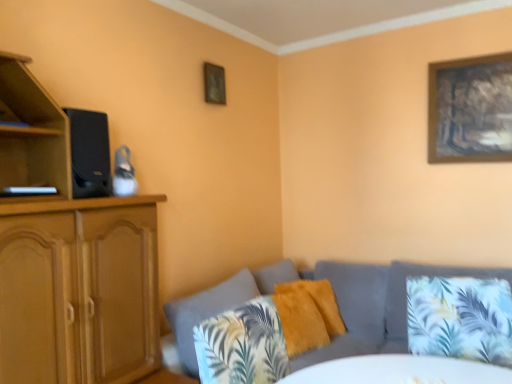
This screenshot has height=384, width=512. What do you see at coordinates (460, 318) in the screenshot? I see `printed fabric pillow at lower right, which is counted as the 3th pillow, starting from the back` at bounding box center [460, 318].

What do you see at coordinates (214, 84) in the screenshot? I see `wooden picture frame at upper center, placed as the second picture frame when sorted from right to left` at bounding box center [214, 84].

This screenshot has width=512, height=384. What do you see at coordinates (318, 301) in the screenshot?
I see `fuzzy yellow pillow at center, which ranks as the 3th pillow in front-to-back order` at bounding box center [318, 301].

Find the location of a particular element. The image size is (512, 384). fluffy orange pillow at center, marked as the second pillow in a front-to-back arrangement is located at coordinates (300, 322).

This screenshot has height=384, width=512. What are the coordinates of `black matte speaker at left` in the screenshot? It's located at (89, 153).

At what (x,y) coordinates should I click in order to perform the action: click on printed fabric pillow at lower right, which is counted as the 3th pillow, starting from the back. Please return your answer as a coordinate pair (x, y). The height and width of the screenshot is (384, 512). Looking at the image, I should click on (460, 318).

Could you tell me if textured gray couch at lower right is turned towards fluffy orange pillow at center, marked as the second pillow in a front-to-back arrangement?

Yes, textured gray couch at lower right faces towards fluffy orange pillow at center, marked as the second pillow in a front-to-back arrangement.

Is textured gray couch at lower right taller or shorter than fluffy orange pillow at center, positioned as the second pillow in back-to-front order?

Clearly, textured gray couch at lower right is taller compared to fluffy orange pillow at center, positioned as the second pillow in back-to-front order.

From the image's perspective, does textured gray couch at lower right appear higher than fluffy orange pillow at center, positioned as the second pillow in back-to-front order?

No.

Is textured gray couch at lower right not close to fluffy orange pillow at center, marked as the second pillow in a front-to-back arrangement?

That's not correct — textured gray couch at lower right is a little close to fluffy orange pillow at center, marked as the second pillow in a front-to-back arrangement.

Is wooden framed artwork at upper right, which is the 1th picture frame in right-to-left order, smaller than black matte speaker at left?

Incorrect, wooden framed artwork at upper right, which is the 1th picture frame in right-to-left order, is not smaller in size than black matte speaker at left.

What are the coordinates of `speaker below the wooden framed artwork at upper right, which is the 1th picture frame in right-to-left order (from a real-world perspective)` in the screenshot? It's located at (89, 153).

Which object is further away from the camera, wooden framed artwork at upper right, which is the 1th picture frame in right-to-left order, or black matte speaker at left?

Positioned behind is wooden framed artwork at upper right, which is the 1th picture frame in right-to-left order.

Is wooden framed artwork at upper right, arranged as the second picture frame when viewed from the left, looking in the opposite direction of black matte speaker at left?

No, wooden framed artwork at upper right, arranged as the second picture frame when viewed from the left, is not facing the opposite direction of black matte speaker at left.

From the image's perspective, is wooden framed artwork at upper right, arranged as the second picture frame when viewed from the left, located above or below fluffy orange pillow at center, marked as the second pillow in a front-to-back arrangement?

wooden framed artwork at upper right, arranged as the second picture frame when viewed from the left, is situated higher than fluffy orange pillow at center, marked as the second pillow in a front-to-back arrangement, in the image.

Does wooden framed artwork at upper right, arranged as the second picture frame when viewed from the left, lie behind fluffy orange pillow at center, positioned as the second pillow in back-to-front order?

Yes, it is.

Do you think wooden framed artwork at upper right, arranged as the second picture frame when viewed from the left, is within fluffy orange pillow at center, positioned as the second pillow in back-to-front order, or outside of it?

wooden framed artwork at upper right, arranged as the second picture frame when viewed from the left, is outside fluffy orange pillow at center, positioned as the second pillow in back-to-front order.

From a real-world perspective, is wooden framed artwork at upper right, arranged as the second picture frame when viewed from the left, over fluffy orange pillow at center, marked as the second pillow in a front-to-back arrangement?

Yes.

Considering the sizes of textured gray couch at lower right and fuzzy yellow pillow at center, which is the first pillow in back-to-front order, in the image, is textured gray couch at lower right taller or shorter than fuzzy yellow pillow at center, which is the first pillow in back-to-front order,?

→ In the image, textured gray couch at lower right appears to be taller than fuzzy yellow pillow at center, which is the first pillow in back-to-front order.

Does textured gray couch at lower right touch fuzzy yellow pillow at center, which ranks as the 3th pillow in front-to-back order?

No, textured gray couch at lower right is not with fuzzy yellow pillow at center, which ranks as the 3th pillow in front-to-back order.

Measure the distance between textured gray couch at lower right and fuzzy yellow pillow at center, which ranks as the 3th pillow in front-to-back order.

A distance of 10.72 inches exists between textured gray couch at lower right and fuzzy yellow pillow at center, which ranks as the 3th pillow in front-to-back order.

Looking at this image, from a real-world perspective, is textured gray couch at lower right physically located above or below fuzzy yellow pillow at center, which ranks as the 3th pillow in front-to-back order?

textured gray couch at lower right is below fuzzy yellow pillow at center, which ranks as the 3th pillow in front-to-back order.

From the image's perspective, which one is positioned lower, fluffy orange pillow at center, marked as the second pillow in a front-to-back arrangement, or wooden picture frame at upper center, the first picture frame when ordered from left to right?

From the image's view, fluffy orange pillow at center, marked as the second pillow in a front-to-back arrangement, is below.

Is wooden picture frame at upper center, placed as the second picture frame when sorted from right to left, at the back of fluffy orange pillow at center, positioned as the second pillow in back-to-front order?

No, fluffy orange pillow at center, positioned as the second pillow in back-to-front order, is not facing the opposite direction of wooden picture frame at upper center, placed as the second picture frame when sorted from right to left.

From a real-world perspective, is fluffy orange pillow at center, marked as the second pillow in a front-to-back arrangement, physically below wooden picture frame at upper center, placed as the second picture frame when sorted from right to left?

Correct, in the physical world, fluffy orange pillow at center, marked as the second pillow in a front-to-back arrangement, is lower than wooden picture frame at upper center, placed as the second picture frame when sorted from right to left.

Is fluffy orange pillow at center, marked as the second pillow in a front-to-back arrangement, at the left side of wooden picture frame at upper center, the first picture frame when ordered from left to right?

Incorrect, fluffy orange pillow at center, marked as the second pillow in a front-to-back arrangement, is not on the left side of wooden picture frame at upper center, the first picture frame when ordered from left to right.

Is printed fabric pillow at lower right, the 1th pillow from the front, at the left side of fluffy orange pillow at center, positioned as the second pillow in back-to-front order?

No, printed fabric pillow at lower right, the 1th pillow from the front, is not to the left of fluffy orange pillow at center, positioned as the second pillow in back-to-front order.

Which of these two, printed fabric pillow at lower right, which is counted as the 3th pillow, starting from the back, or fluffy orange pillow at center, positioned as the second pillow in back-to-front order, is wider?

With larger width is printed fabric pillow at lower right, which is counted as the 3th pillow, starting from the back.

Is printed fabric pillow at lower right, the 1th pillow from the front, far from fluffy orange pillow at center, marked as the second pillow in a front-to-back arrangement?

They are positioned close to each other.

Is the depth of printed fabric pillow at lower right, which is counted as the 3th pillow, starting from the back, greater than that of fluffy orange pillow at center, marked as the second pillow in a front-to-back arrangement?

No, printed fabric pillow at lower right, which is counted as the 3th pillow, starting from the back, is closer to the camera.

Does textured gray couch at lower right lie behind printed fabric pillow at lower right, the 1th pillow from the front?

No, it is not.

Identify the location of pillow that is the 1st one when counting backward from the textured gray couch at lower right. (460, 318).

Does textured gray couch at lower right have a smaller size compared to printed fabric pillow at lower right, which is counted as the 3th pillow, starting from the back?

Incorrect, textured gray couch at lower right is not smaller in size than printed fabric pillow at lower right, which is counted as the 3th pillow, starting from the back.

From a real-world perspective, starting from the textured gray couch at lower right, which pillow is the 1st one vertically above it? Please provide its 2D coordinates.

[(300, 322)]

In the image, there is a wooden framed artwork at upper right, arranged as the second picture frame when viewed from the left. At what (x,y) coordinates should I click in order to perform the action: click on speaker below it (from a real-world perspective). Please return your answer as a coordinate pair (x, y). The image size is (512, 384). Looking at the image, I should click on (89, 153).

When comparing their distances from wooden picture frame at upper center, the first picture frame when ordered from left to right, does fluffy orange pillow at center, positioned as the second pillow in back-to-front order, or fuzzy yellow pillow at center, which ranks as the 3th pillow in front-to-back order, seem closer?

Based on the image, fuzzy yellow pillow at center, which ranks as the 3th pillow in front-to-back order, appears to be nearer to wooden picture frame at upper center, the first picture frame when ordered from left to right.

When comparing their distances from wooden framed artwork at upper right, which is the 1th picture frame in right-to-left order, does black matte speaker at left or textured gray couch at lower right seem further?

black matte speaker at left lies further to wooden framed artwork at upper right, which is the 1th picture frame in right-to-left order, than the other object.

Estimate the real-world distances between objects in this image. Which object is closer to fuzzy yellow pillow at center, which ranks as the 3th pillow in front-to-back order, wooden framed artwork at upper right, which is the 1th picture frame in right-to-left order, or printed fabric pillow at lower right, the 1th pillow from the front?

Among the two, printed fabric pillow at lower right, the 1th pillow from the front, is located nearer to fuzzy yellow pillow at center, which ranks as the 3th pillow in front-to-back order.

Based on their spatial positions, is fuzzy yellow pillow at center, which is the first pillow in back-to-front order, or textured gray couch at lower right further from wooden framed artwork at upper right, arranged as the second picture frame when viewed from the left?

fuzzy yellow pillow at center, which is the first pillow in back-to-front order.

When comparing their distances from fluffy orange pillow at center, positioned as the second pillow in back-to-front order, does textured gray couch at lower right or printed fabric pillow at lower right, the 1th pillow from the front, seem further?

Based on the image, printed fabric pillow at lower right, the 1th pillow from the front, appears to be further to fluffy orange pillow at center, positioned as the second pillow in back-to-front order.

From the image, which object appears to be nearer to printed fabric pillow at lower right, the 1th pillow from the front, wooden picture frame at upper center, the first picture frame when ordered from left to right, or fluffy orange pillow at center, marked as the second pillow in a front-to-back arrangement?

fluffy orange pillow at center, marked as the second pillow in a front-to-back arrangement.

When comparing their distances from fuzzy yellow pillow at center, which ranks as the 3th pillow in front-to-back order, does black matte speaker at left or textured gray couch at lower right seem further?

The object further to fuzzy yellow pillow at center, which ranks as the 3th pillow in front-to-back order, is black matte speaker at left.

Estimate the real-world distances between objects in this image. Which object is closer to wooden picture frame at upper center, placed as the second picture frame when sorted from right to left, printed fabric pillow at lower right, which is counted as the 3th pillow, starting from the back, or textured gray couch at lower right?

textured gray couch at lower right.

Where is `studio couch between black matte speaker at left and printed fabric pillow at lower right, the 1th pillow from the front, from left to right`? studio couch between black matte speaker at left and printed fabric pillow at lower right, the 1th pillow from the front, from left to right is located at coordinates (337, 300).

The width and height of the screenshot is (512, 384). What are the coordinates of `speaker between wooden picture frame at upper center, the first picture frame when ordered from left to right, and fluffy orange pillow at center, positioned as the second pillow in back-to-front order, in the vertical direction` in the screenshot? It's located at (89, 153).

This screenshot has height=384, width=512. I want to click on speaker between wooden picture frame at upper center, placed as the second picture frame when sorted from right to left, and fuzzy yellow pillow at center, which ranks as the 3th pillow in front-to-back order, in the vertical direction, so click(89, 153).

Where is `pillow between wooden picture frame at upper center, placed as the second picture frame when sorted from right to left, and fuzzy yellow pillow at center, which is the first pillow in back-to-front order, in the up-down direction`? The height and width of the screenshot is (384, 512). pillow between wooden picture frame at upper center, placed as the second picture frame when sorted from right to left, and fuzzy yellow pillow at center, which is the first pillow in back-to-front order, in the up-down direction is located at coordinates (460, 318).